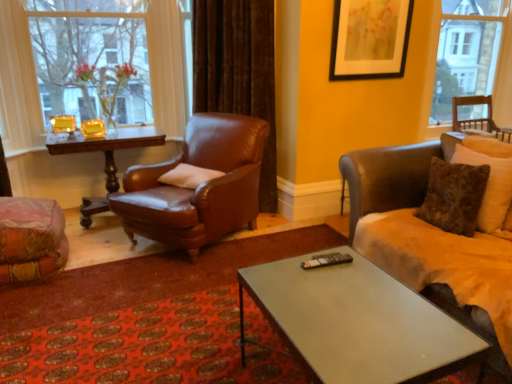
Where is `vacant space positioned to the left of black plastic remote control at center`? vacant space positioned to the left of black plastic remote control at center is located at coordinates [x=287, y=268].